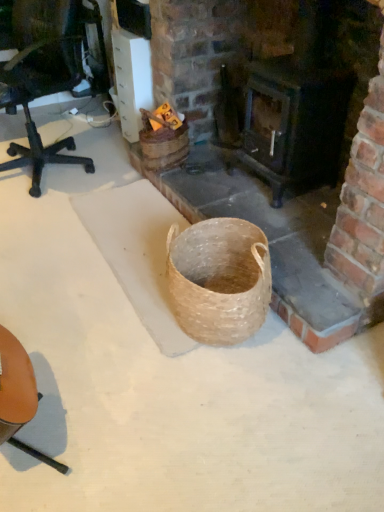
Question: Do you think dark wood stove at center is within brick fireplace at center, or outside of it?

Choices:
 (A) outside
 (B) inside

Answer: (A)

Question: In terms of width, does dark wood stove at center look wider or thinner when compared to brick fireplace at center?

Choices:
 (A) wide
 (B) thin

Answer: (B)

Question: Which object is positioned farthest from the dark wood stove at center?

Choices:
 (A) brick fireplace at center
 (B) brown leather chair at lower left

Answer: (B)

Question: Based on their relative distances, which object is nearer to the dark wood stove at center?

Choices:
 (A) brown leather chair at lower left
 (B) brick fireplace at center

Answer: (B)